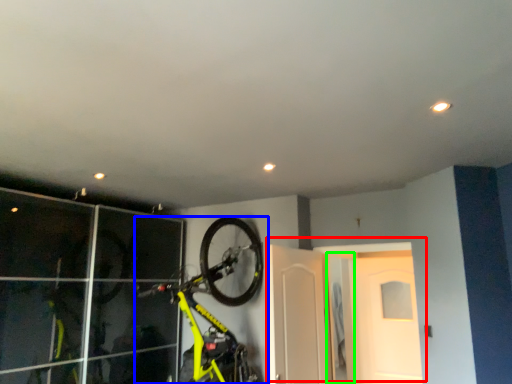
Question: Which object is positioned farthest from door (highlighted by a red box)? Select from bicycle (highlighted by a blue box) and door (highlighted by a green box).

Choices:
 (A) bicycle
 (B) door

Answer: (B)